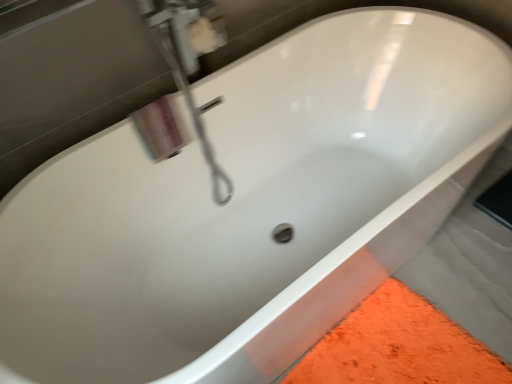
What do you see at coordinates (187, 27) in the screenshot? This screenshot has height=384, width=512. I see `white glossy soap dispenser at upper left, the second plumbing fixture when ordered from front to back` at bounding box center [187, 27].

At what (x,y) coordinates should I click in order to perform the action: click on white glossy soap dispenser at upper left, placed as the first plumbing fixture when sorted from back to front. Please return your answer as a coordinate pair (x, y). Looking at the image, I should click on (187, 27).

This screenshot has width=512, height=384. Describe the element at coordinates (190, 60) in the screenshot. I see `polished chrome faucet at upper left, marked as the second plumbing fixture in a back-to-front arrangement` at that location.

What are the coordinates of `polished chrome faucet at upper left, marked as the second plumbing fixture in a back-to-front arrangement` in the screenshot? It's located at (190, 60).

What are the coordinates of `white glossy soap dispenser at upper left, the second plumbing fixture when ordered from front to back` in the screenshot? It's located at (187, 27).

Is white glossy soap dispenser at upper left, placed as the first plumbing fixture when sorted from back to front, at the left side of polished chrome faucet at upper left, the 1th plumbing fixture from the front?

Incorrect, white glossy soap dispenser at upper left, placed as the first plumbing fixture when sorted from back to front, is not on the left side of polished chrome faucet at upper left, the 1th plumbing fixture from the front.

Is white glossy soap dispenser at upper left, placed as the first plumbing fixture when sorted from back to front, further to the viewer compared to polished chrome faucet at upper left, the 1th plumbing fixture from the front?

Yes, the depth of white glossy soap dispenser at upper left, placed as the first plumbing fixture when sorted from back to front, is greater than that of polished chrome faucet at upper left, the 1th plumbing fixture from the front.

Which is closer, (162, 4) or (192, 115)?

The point (162, 4) is closer.

From the image's perspective, between white glossy soap dispenser at upper left, placed as the first plumbing fixture when sorted from back to front, and polished chrome faucet at upper left, marked as the second plumbing fixture in a back-to-front arrangement, which one is located above?

white glossy soap dispenser at upper left, placed as the first plumbing fixture when sorted from back to front, appears higher in the image.

In the scene shown: From a real-world perspective, is white glossy soap dispenser at upper left, the second plumbing fixture when ordered from front to back, under polished chrome faucet at upper left, marked as the second plumbing fixture in a back-to-front arrangement?

No, from a real-world perspective, white glossy soap dispenser at upper left, the second plumbing fixture when ordered from front to back, is not under polished chrome faucet at upper left, marked as the second plumbing fixture in a back-to-front arrangement.

Considering the relative sizes of white glossy soap dispenser at upper left, the second plumbing fixture when ordered from front to back, and polished chrome faucet at upper left, the 1th plumbing fixture from the front, in the image provided, is white glossy soap dispenser at upper left, the second plumbing fixture when ordered from front to back, wider than polished chrome faucet at upper left, the 1th plumbing fixture from the front,?

No, white glossy soap dispenser at upper left, the second plumbing fixture when ordered from front to back, is not wider than polished chrome faucet at upper left, the 1th plumbing fixture from the front.

Is white glossy soap dispenser at upper left, the second plumbing fixture when ordered from front to back, taller than polished chrome faucet at upper left, marked as the second plumbing fixture in a back-to-front arrangement?

In fact, white glossy soap dispenser at upper left, the second plumbing fixture when ordered from front to back, may be shorter than polished chrome faucet at upper left, marked as the second plumbing fixture in a back-to-front arrangement.

Does white glossy soap dispenser at upper left, the second plumbing fixture when ordered from front to back, have a larger size compared to polished chrome faucet at upper left, the 1th plumbing fixture from the front?

No, white glossy soap dispenser at upper left, the second plumbing fixture when ordered from front to back, is not bigger than polished chrome faucet at upper left, the 1th plumbing fixture from the front.

Would you say white glossy soap dispenser at upper left, the second plumbing fixture when ordered from front to back, contains polished chrome faucet at upper left, marked as the second plumbing fixture in a back-to-front arrangement?

No, polished chrome faucet at upper left, marked as the second plumbing fixture in a back-to-front arrangement, is located outside of white glossy soap dispenser at upper left, the second plumbing fixture when ordered from front to back.

Is white glossy soap dispenser at upper left, the second plumbing fixture when ordered from front to back, not near polished chrome faucet at upper left, marked as the second plumbing fixture in a back-to-front arrangement?

No.

Is white glossy soap dispenser at upper left, placed as the first plumbing fixture when sorted from back to front, turned away from polished chrome faucet at upper left, the 1th plumbing fixture from the front?

No.

Can you tell me how much white glossy soap dispenser at upper left, placed as the first plumbing fixture when sorted from back to front, and polished chrome faucet at upper left, the 1th plumbing fixture from the front, differ in facing direction?

There is a 0.000656-degree angle between the facing directions of white glossy soap dispenser at upper left, placed as the first plumbing fixture when sorted from back to front, and polished chrome faucet at upper left, the 1th plumbing fixture from the front.

Find the location of a particular element. This screenshot has height=384, width=512. plumbing fixture behind the polished chrome faucet at upper left, marked as the second plumbing fixture in a back-to-front arrangement is located at coordinates (187, 27).

In the image, is polished chrome faucet at upper left, the 1th plumbing fixture from the front, on the left side or the right side of white glossy soap dispenser at upper left, the second plumbing fixture when ordered from front to back?

polished chrome faucet at upper left, the 1th plumbing fixture from the front, is to the left of white glossy soap dispenser at upper left, the second plumbing fixture when ordered from front to back.

Based on the photo, considering the relative positions of polished chrome faucet at upper left, the 1th plumbing fixture from the front, and white glossy soap dispenser at upper left, the second plumbing fixture when ordered from front to back, in the image provided, is polished chrome faucet at upper left, the 1th plumbing fixture from the front, in front of white glossy soap dispenser at upper left, the second plumbing fixture when ordered from front to back,?

Yes, the depth of polished chrome faucet at upper left, the 1th plumbing fixture from the front, is less than that of white glossy soap dispenser at upper left, the second plumbing fixture when ordered from front to back.

Between point (187, 24) and point (146, 5), which one is positioned in front?

The point (146, 5) is more forward.

From the image's perspective, is polished chrome faucet at upper left, marked as the second plumbing fixture in a back-to-front arrangement, located above or below white glossy soap dispenser at upper left, placed as the first plumbing fixture when sorted from back to front?

polished chrome faucet at upper left, marked as the second plumbing fixture in a back-to-front arrangement, is situated lower than white glossy soap dispenser at upper left, placed as the first plumbing fixture when sorted from back to front, in the image.

From a real-world perspective, is polished chrome faucet at upper left, marked as the second plumbing fixture in a back-to-front arrangement, positioned above or below white glossy soap dispenser at upper left, placed as the first plumbing fixture when sorted from back to front?

From a real-world perspective, polished chrome faucet at upper left, marked as the second plumbing fixture in a back-to-front arrangement, is physically below white glossy soap dispenser at upper left, placed as the first plumbing fixture when sorted from back to front.

Is polished chrome faucet at upper left, the 1th plumbing fixture from the front, wider than white glossy soap dispenser at upper left, the second plumbing fixture when ordered from front to back?

Indeed, polished chrome faucet at upper left, the 1th plumbing fixture from the front, has a greater width compared to white glossy soap dispenser at upper left, the second plumbing fixture when ordered from front to back.

Which of these two, polished chrome faucet at upper left, marked as the second plumbing fixture in a back-to-front arrangement, or white glossy soap dispenser at upper left, placed as the first plumbing fixture when sorted from back to front, stands shorter?

white glossy soap dispenser at upper left, placed as the first plumbing fixture when sorted from back to front.

In terms of size, does polished chrome faucet at upper left, the 1th plumbing fixture from the front, appear bigger or smaller than white glossy soap dispenser at upper left, placed as the first plumbing fixture when sorted from back to front?

In the image, polished chrome faucet at upper left, the 1th plumbing fixture from the front, appears to be larger than white glossy soap dispenser at upper left, placed as the first plumbing fixture when sorted from back to front.

Is white glossy soap dispenser at upper left, placed as the first plumbing fixture when sorted from back to front, inside polished chrome faucet at upper left, the 1th plumbing fixture from the front?

Definitely not — white glossy soap dispenser at upper left, placed as the first plumbing fixture when sorted from back to front, is not inside polished chrome faucet at upper left, the 1th plumbing fixture from the front.

Is polished chrome faucet at upper left, marked as the second plumbing fixture in a back-to-front arrangement, with white glossy soap dispenser at upper left, the second plumbing fixture when ordered from front to back?

Yes, the surface of polished chrome faucet at upper left, marked as the second plumbing fixture in a back-to-front arrangement, is in contact with white glossy soap dispenser at upper left, the second plumbing fixture when ordered from front to back.

Could you tell me if polished chrome faucet at upper left, the 1th plumbing fixture from the front, is turned towards white glossy soap dispenser at upper left, placed as the first plumbing fixture when sorted from back to front?

No, polished chrome faucet at upper left, the 1th plumbing fixture from the front, does not turn towards white glossy soap dispenser at upper left, placed as the first plumbing fixture when sorted from back to front.

Locate an element on the screen. Image resolution: width=512 pixels, height=384 pixels. plumbing fixture on the left of white glossy soap dispenser at upper left, placed as the first plumbing fixture when sorted from back to front is located at coordinates (190, 60).

Where is `plumbing fixture that is on the left side of white glossy soap dispenser at upper left, the second plumbing fixture when ordered from front to back`? The width and height of the screenshot is (512, 384). plumbing fixture that is on the left side of white glossy soap dispenser at upper left, the second plumbing fixture when ordered from front to back is located at coordinates click(x=190, y=60).

I want to click on plumbing fixture behind the polished chrome faucet at upper left, the 1th plumbing fixture from the front, so click(x=187, y=27).